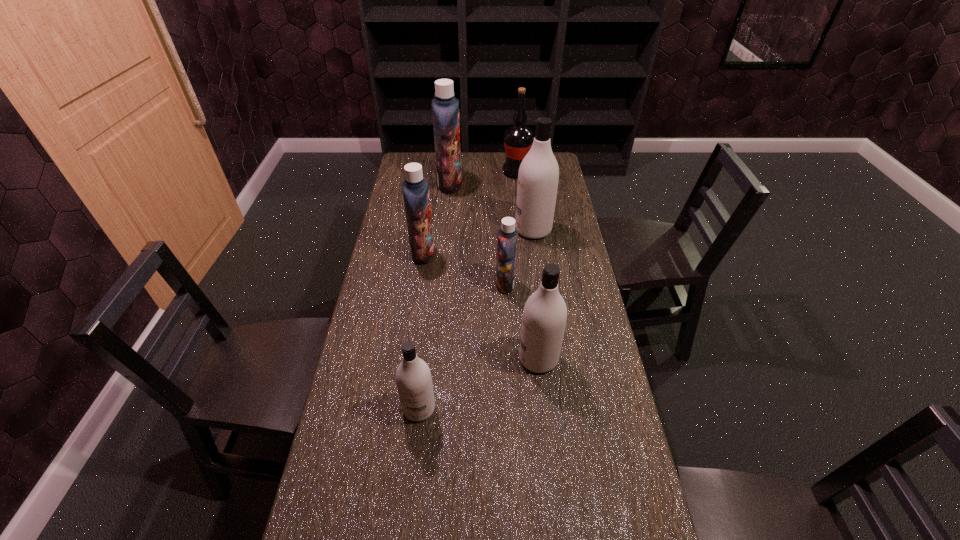
Select which shampoo appears as the closest to the nearest white shampoo. Please provide its 2D coordinates. Your answer should be formatted as a tuple, i.e. [(x, y)], where the tuple contains the x and y coordinates of a point satisfying the conditions above.

[(544, 317)]

Where is `the third closest white shampoo to the red wine bottle`? The width and height of the screenshot is (960, 540). the third closest white shampoo to the red wine bottle is located at coordinates (414, 383).

The width and height of the screenshot is (960, 540). What are the coordinates of `white shampoo that is the second nearest to the biggest blue shampoo` in the screenshot? It's located at (544, 317).

Where is `the second closest blue shampoo to the farthest white shampoo`? This screenshot has height=540, width=960. the second closest blue shampoo to the farthest white shampoo is located at coordinates (445, 107).

Image resolution: width=960 pixels, height=540 pixels. I want to click on blue shampoo that is the second closest one to the second biggest blue shampoo, so click(445, 107).

Identify the location of vacant region that satisfies the following two spatial constraints: 1. on the front label of the biggest blue shampoo; 2. on the front-facing side of the nearest shampoo. (429, 408).